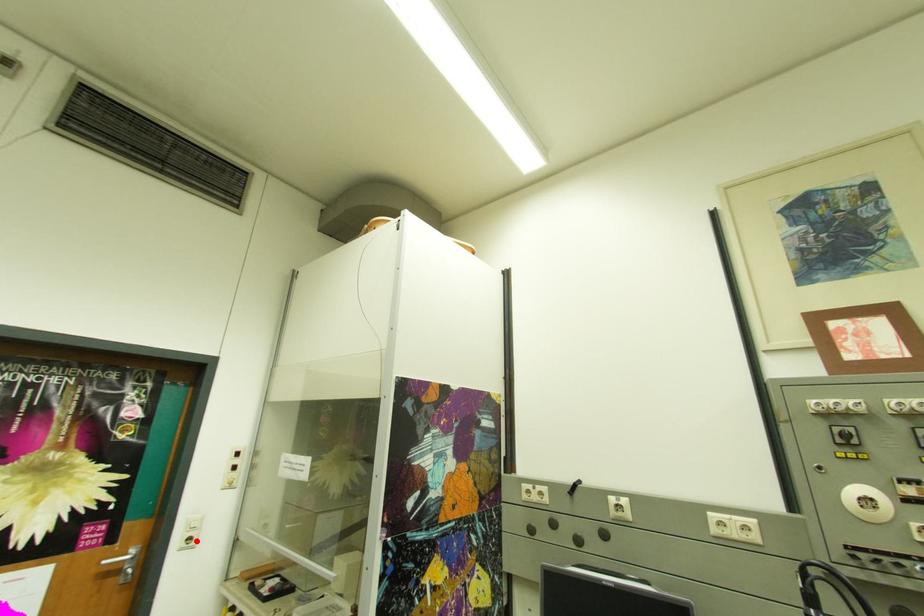
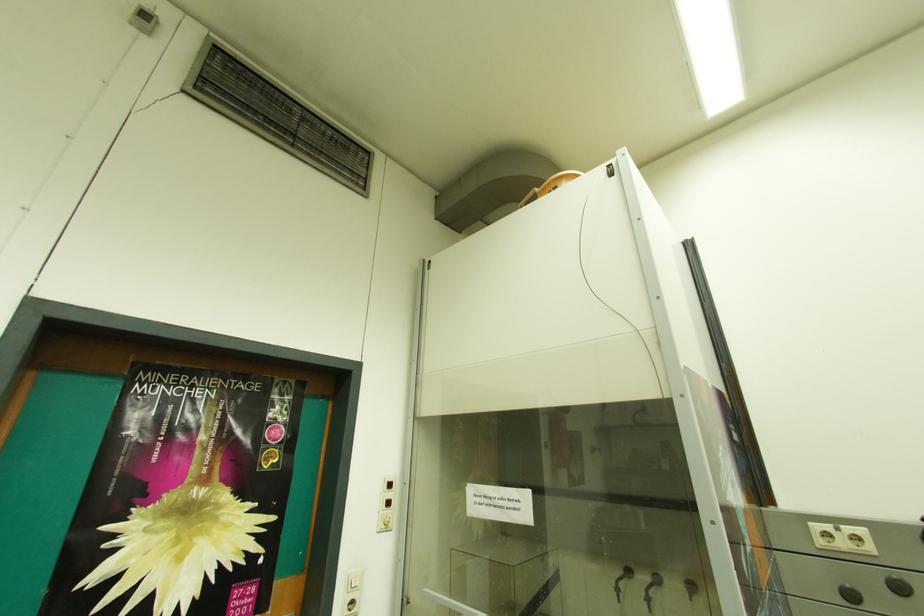
The point at the highlighted location is marked in the first image. Where is the corresponding point in the second image?

(359, 605)